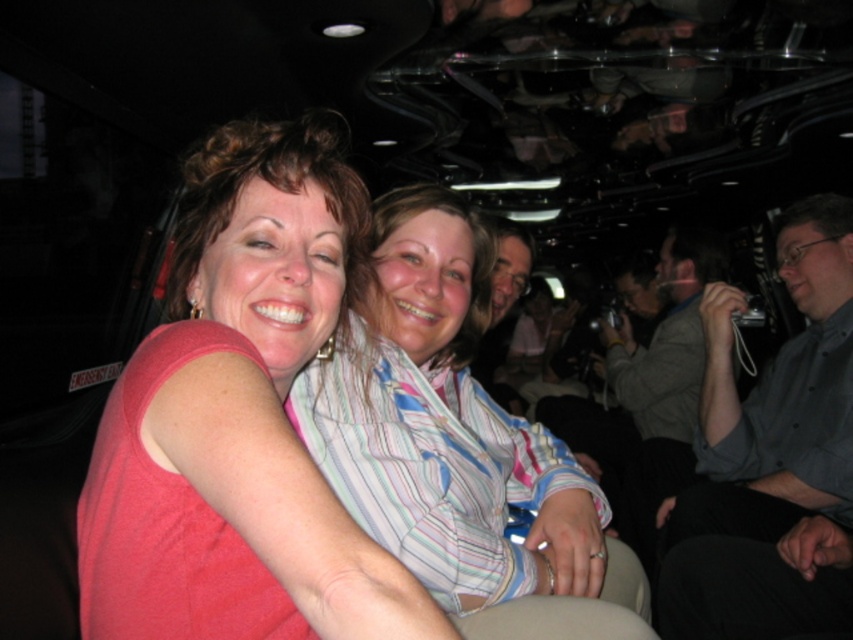
You are a photographer at the event and want to capture a photo that includes both the matte pink shirt at center and the striped cotton shirt at center. Which shirt should you position on the left side of your frame to ensure both are visible?

The matte pink shirt at center is already positioned on the left side of the striped cotton shirt at center, so positioning it on the left side of your frame will ensure both are visible.